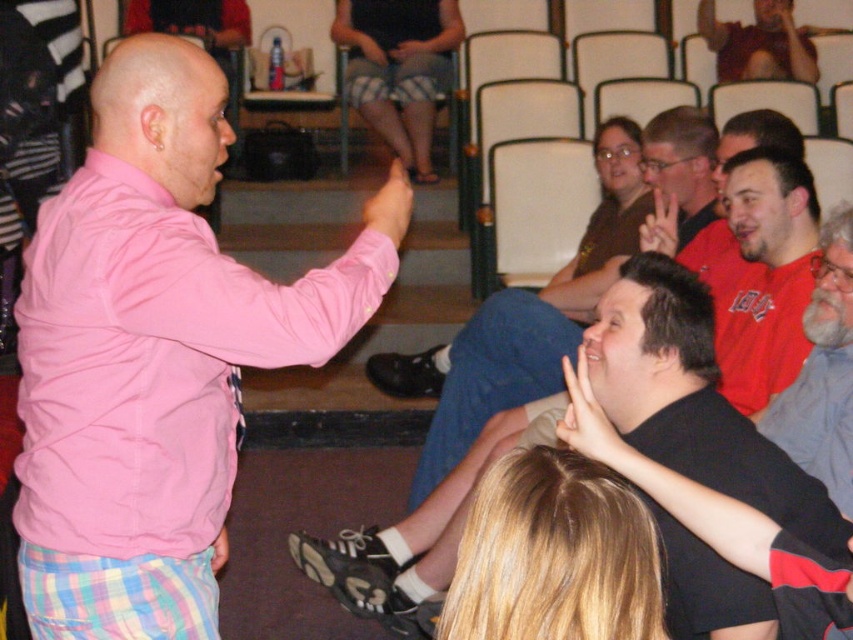
Question: Which point is closer to the camera?

Choices:
 (A) (772, 32)
 (B) (390, 193)

Answer: (B)

Question: Is white matte hand at lower center closer to camera compared to pink fabric pants at lower left?

Choices:
 (A) no
 (B) yes

Answer: (B)

Question: Is white matte hand at lower center positioned in front of pink fabric pants at lower left?

Choices:
 (A) no
 (B) yes

Answer: (B)

Question: Among these objects, which one is nearest to the camera?

Choices:
 (A) checkered shorts at center
 (B) white matte hand at center
 (C) gray fabric shirt at right

Answer: (C)

Question: Which object is the farthest from the white matte hand at center?

Choices:
 (A) pink matte shirt at upper left
 (B) matte red shirt at right

Answer: (A)

Question: Does matte red shirt at right appear on the left side of gray fabric shirt at right?

Choices:
 (A) yes
 (B) no

Answer: (B)